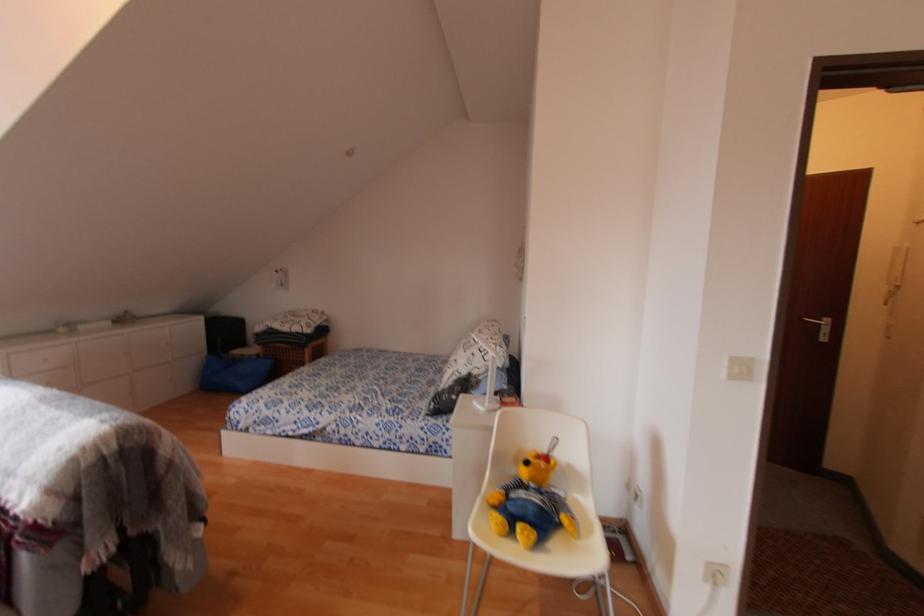
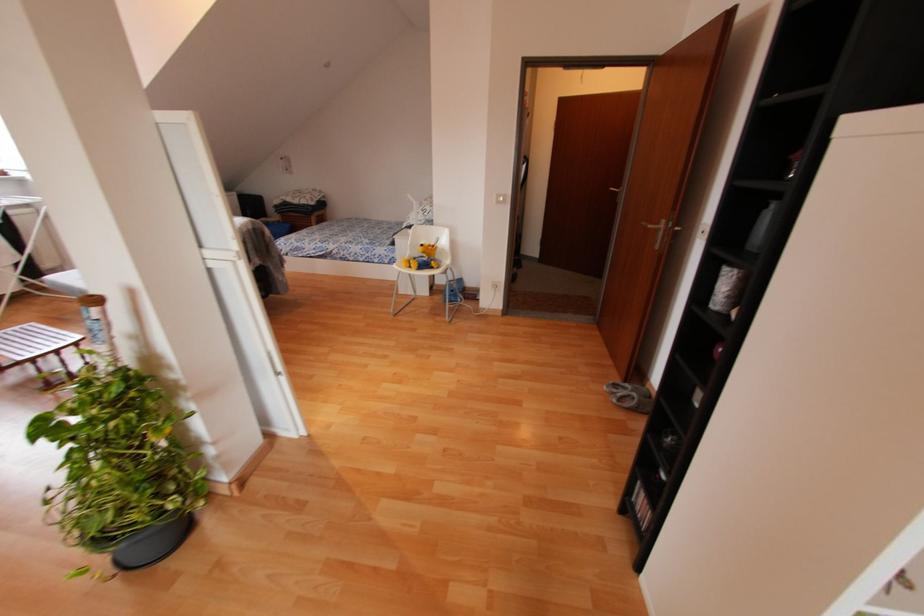
The point at (543, 451) is marked in the first image. Where is the corresponding point in the second image?

(432, 244)